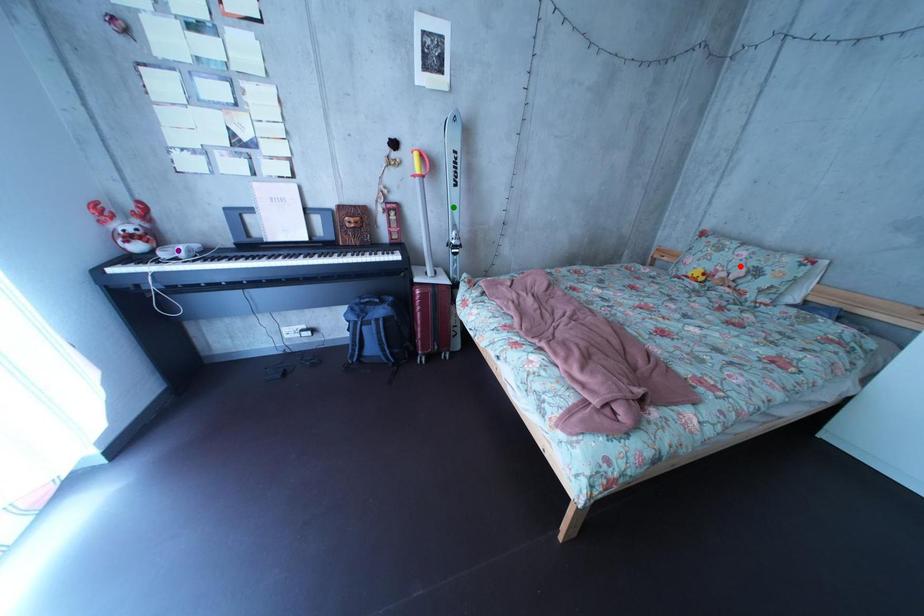
Order these from farthest to nearest:
green point, red point, purple point

1. red point
2. green point
3. purple point